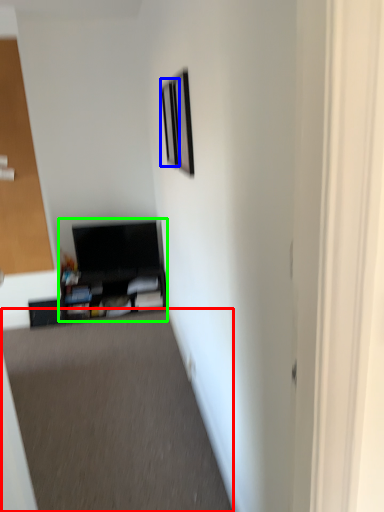
Question: Based on their relative distances, which object is nearer to plain (highlighted by a red box)? Choose from picture frame (highlighted by a blue box) and entertainment center (highlighted by a green box).

Choices:
 (A) picture frame
 (B) entertainment center

Answer: (B)